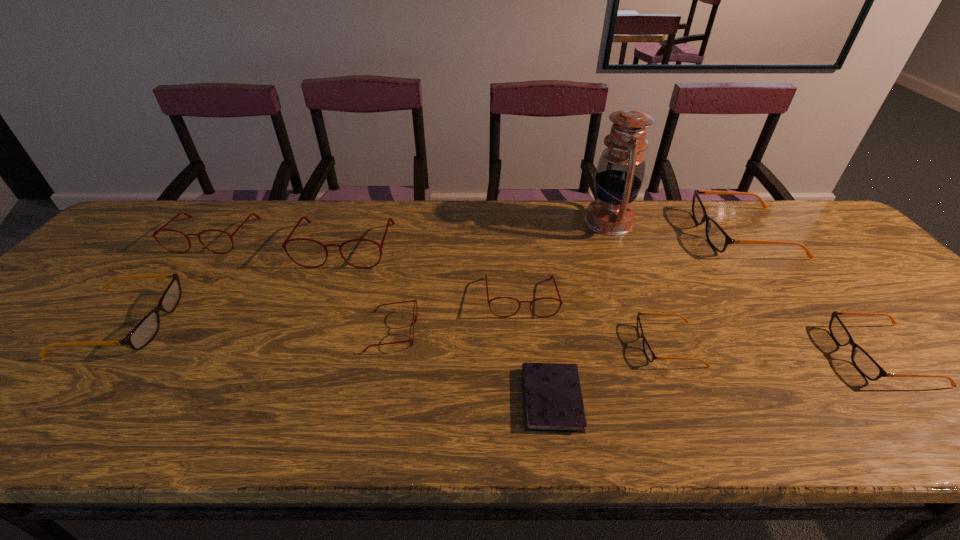
Identify which object is the eighth closest to the third biggest black spectacles. Please provide its 2D coordinates. Your answer should be formatted as a tuple, i.e. [(x, y)], where the tuple contains the x and y coordinates of a point satisfying the conditions above.

[(161, 229)]

Where is `the seventh closest spectacles to the biggest black spectacles`? the seventh closest spectacles to the biggest black spectacles is located at coordinates (148, 327).

The image size is (960, 540). What are the coordinates of `the sixth closest spectacles relative to the smallest black spectacles` in the screenshot? It's located at (161, 229).

Locate which red spectacles ranks in proximity to the third smallest red spectacles. Please provide its 2D coordinates. Your answer should be formatted as a tuple, i.e. [(x, y)], where the tuple contains the x and y coordinates of a point satisfying the conditions above.

[(287, 240)]

Identify which red spectacles is the closest to the second biggest red spectacles. Please provide its 2D coordinates. Your answer should be formatted as a tuple, i.e. [(x, y)], where the tuple contains the x and y coordinates of a point satisfying the conditions above.

[(287, 240)]

You are a GUI agent. You are given a task and a screenshot of the screen. Output one action in this format:
    pyautogui.click(x=<x>, y=<y>)
    Task: Click on the second closest black spectacles to the shortest object
    The width and height of the screenshot is (960, 540).
    Given the screenshot: What is the action you would take?
    pyautogui.click(x=717, y=237)

Find the location of a particular element. This screenshot has width=960, height=540. black spectacles that is the third closest to the third black spectacles from right to left is located at coordinates (148, 327).

At what (x,y) coordinates should I click in order to perform the action: click on free spot that satisfies the following two spatial constraints: 1. on the face of the third biggest red spectacles; 2. on the front-facing side of the second biggest black spectacles. Please return your answer as a coordinate pair (x, y). The image size is (960, 540). Looking at the image, I should click on (523, 322).

The width and height of the screenshot is (960, 540). I want to click on vacant point that satisfies the following two spatial constraints: 1. on the face of the diary; 2. on the right side of the second biggest red spectacles, so click(x=87, y=399).

At what (x,y) coordinates should I click in order to perform the action: click on vacant space that satisfies the following two spatial constraints: 1. on the front-facing side of the second biggest black spectacles; 2. on the right side of the diary. Please return your answer as a coordinate pair (x, y). This screenshot has height=540, width=960. Looking at the image, I should click on (59, 399).